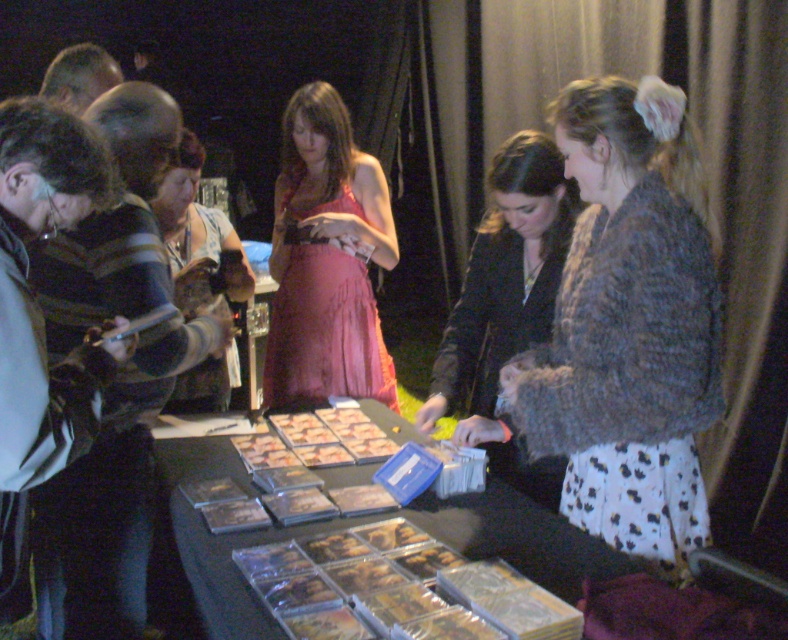
Question: Is dark brown fur coat at center thinner than golden brown pastry at center?

Choices:
 (A) yes
 (B) no

Answer: (B)

Question: Which is nearer to the fuzzy brown jacket at right?

Choices:
 (A) golden brown pastry at center
 (B) pink satin dress at center
 (C) golden crispy chicken at center

Answer: (A)

Question: Which point is farther from the camera taking this photo?

Choices:
 (A) (370, 349)
 (B) (467, 328)

Answer: (A)

Question: Which point appears farthest from the camera in this image?

Choices:
 (A) (398, 556)
 (B) (300, 330)
 (C) (175, 198)
 (D) (686, 252)

Answer: (B)

Question: Is pink satin dress at center thinner than matte brown purse at center?

Choices:
 (A) no
 (B) yes

Answer: (A)

Question: Considering the relative positions of dark brown fur coat at center and golden crispy chicken at center in the image provided, where is dark brown fur coat at center located with respect to golden crispy chicken at center?

Choices:
 (A) right
 (B) left

Answer: (A)